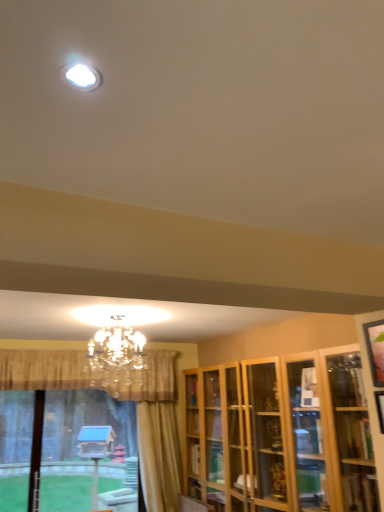
Question: Is point (377, 412) closer or farther from the camera than point (367, 326)?

Choices:
 (A) closer
 (B) farther

Answer: (A)

Question: Looking at their shapes, would you say wooden picture frame at right, acting as the 2th picture frame starting from the top, is wider or thinner than wooden picture frame at upper right, which is counted as the first picture frame, starting from the top?

Choices:
 (A) thin
 (B) wide

Answer: (B)

Question: Considering the real-world distances, which object is farthest from the translucent glass bay window at lower left?

Choices:
 (A) crystal chandelier at upper center
 (B) wooden picture frame at upper right, which is counted as the first picture frame, starting from the top
 (C) white glossy light fixture at upper center
 (D) wooden cabinet at right
 (E) wooden picture frame at right, which is the first picture frame from bottom to top

Answer: (C)

Question: Which object is positioned closest to the translucent glass bay window at lower left?

Choices:
 (A) wooden picture frame at right, which is the first picture frame from bottom to top
 (B) wooden picture frame at upper right, marked as the 2th picture frame in a bottom-to-top arrangement
 (C) white glossy light fixture at upper center
 (D) crystal chandelier at upper center
 (E) wooden cabinet at right

Answer: (D)